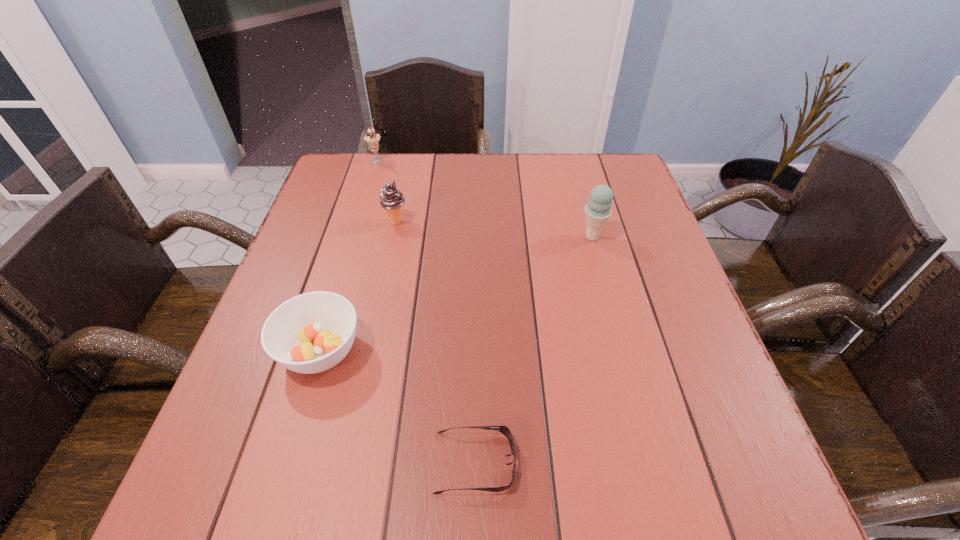
Locate an element on the screen. free spot located 0.300m on the front of the second icecream from right to left is located at coordinates (374, 323).

What are the coordinates of `free space located 0.170m on the right of the second nearest object` in the screenshot? It's located at (452, 351).

At what (x,y) coordinates should I click in order to perform the action: click on free space located on the front-facing side of the nearest object. Please return your answer as a coordinate pair (x, y). The height and width of the screenshot is (540, 960). Looking at the image, I should click on (584, 462).

Where is `object that is at the far edge`? This screenshot has height=540, width=960. object that is at the far edge is located at coordinates (372, 138).

You are a GUI agent. You are given a task and a screenshot of the screen. Output one action in this format:
    pyautogui.click(x=<x>, y=<y>)
    Task: Click on the object that is at the near edge
    
    Given the screenshot: What is the action you would take?
    pyautogui.click(x=504, y=430)

Identify the location of icecream that is at the left edge. (372, 138).

Locate an element on the screen. The image size is (960, 540). soup bowl situated at the left edge is located at coordinates (310, 333).

This screenshot has height=540, width=960. In order to click on object that is at the right edge in this screenshot , I will do `click(598, 210)`.

I want to click on object located at the far left corner, so click(x=372, y=138).

Image resolution: width=960 pixels, height=540 pixels. I want to click on vacant space at the far edge of the desktop, so click(x=427, y=158).